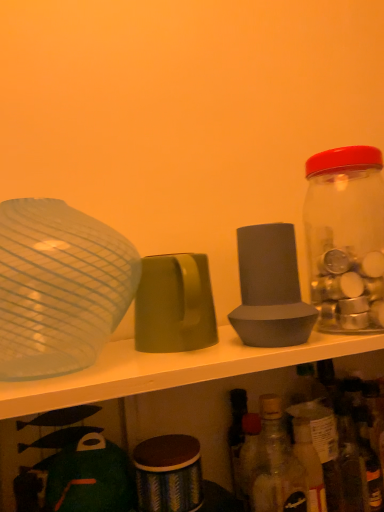
Find the location of a particular element. Image resolution: width=384 pixels, height=512 pixels. vacant region under transparent glass bowl at left, which is the 3th tableware from right to left (from a real-world perspective) is located at coordinates (79, 374).